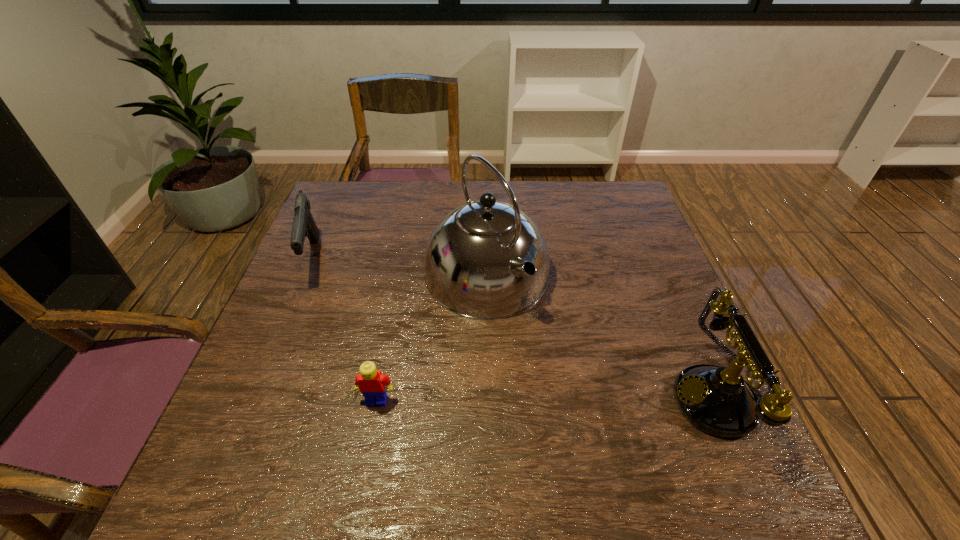
In order to click on object at the left edge in this screenshot , I will do `click(304, 225)`.

I want to click on object positioned at the right edge, so click(717, 400).

I want to click on object that is at the near right corner, so click(717, 400).

Identify the location of free spot at the far edge of the desktop. Image resolution: width=960 pixels, height=540 pixels. (446, 196).

Image resolution: width=960 pixels, height=540 pixels. Identify the location of free space at the near edge. (588, 435).

The width and height of the screenshot is (960, 540). In the image, there is a desktop. Find the location of `free space at the left edge`. free space at the left edge is located at coordinates (322, 240).

You are a GUI agent. You are given a task and a screenshot of the screen. Output one action in this format:
    pyautogui.click(x=<x>, y=<y>)
    Task: Click on the vacant point at the right edge
    
    Given the screenshot: What is the action you would take?
    pyautogui.click(x=675, y=321)

In order to click on free space at the far left corner in this screenshot , I will do `click(341, 190)`.

The height and width of the screenshot is (540, 960). In the image, there is a desktop. Find the location of `vacant space at the near left corner`. vacant space at the near left corner is located at coordinates (280, 414).

The height and width of the screenshot is (540, 960). What are the coordinates of `free space at the far right corner` in the screenshot? It's located at (612, 195).